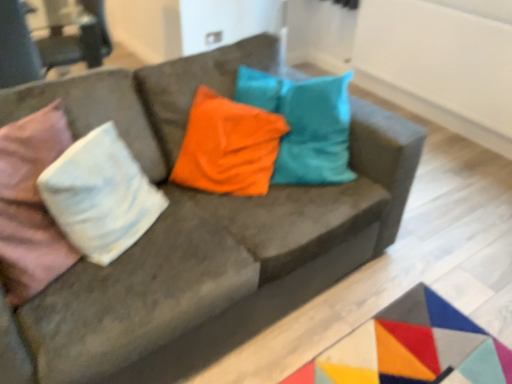
Measure the distance between velvet pink armchair at upper left and camera.

velvet pink armchair at upper left and camera are 8.76 feet apart from each other.

What do you see at coordinates (71, 35) in the screenshot? I see `velvet pink armchair at upper left` at bounding box center [71, 35].

Find the location of a particular element. The width and height of the screenshot is (512, 384). velvet pink armchair at upper left is located at coordinates (71, 35).

The width and height of the screenshot is (512, 384). I want to click on white cotton pillow at left, so click(100, 195).

The width and height of the screenshot is (512, 384). Describe the element at coordinates (100, 195) in the screenshot. I see `white cotton pillow at left` at that location.

You are a GUI agent. You are given a task and a screenshot of the screen. Output one action in this format:
    pyautogui.click(x=<x>, y=<y>)
    Task: Click on the velvet pink armchair at upper left
    The width and height of the screenshot is (512, 384).
    Given the screenshot: What is the action you would take?
    pyautogui.click(x=71, y=35)

Is white cotton pillow at left at the right side of velvet pink armchair at upper left?

Yes.

Is white cotton pillow at left further to camera compared to velvet pink armchair at upper left?

No, white cotton pillow at left is closer to the viewer.

Is point (93, 199) closer or farther from the camera than point (42, 10)?

Point (93, 199) is positioned closer to the camera compared to point (42, 10).

From the image's perspective, is white cotton pillow at left beneath velvet pink armchair at upper left?

Yes.

From a real-world perspective, is white cotton pillow at left below velvet pink armchair at upper left?

Actually, white cotton pillow at left is physically above velvet pink armchair at upper left in the real world.

Considering the sizes of objects white cotton pillow at left and velvet pink armchair at upper left in the image provided, who is thinner, white cotton pillow at left or velvet pink armchair at upper left?

Thinner between the two is white cotton pillow at left.

Between white cotton pillow at left and velvet pink armchair at upper left, which one has less height?

white cotton pillow at left is shorter.

Does white cotton pillow at left have a smaller size compared to velvet pink armchair at upper left?

Yes, white cotton pillow at left is smaller than velvet pink armchair at upper left.

Do you think white cotton pillow at left is within velvet pink armchair at upper left, or outside of it?

white cotton pillow at left is outside velvet pink armchair at upper left.

Is there a large distance between white cotton pillow at left and velvet pink armchair at upper left?

Yes.

Is white cotton pillow at left oriented towards velvet pink armchair at upper left?

No, white cotton pillow at left is not oriented towards velvet pink armchair at upper left.

Measure the distance between white cotton pillow at left and velvet pink armchair at upper left.

white cotton pillow at left is 6.16 feet from velvet pink armchair at upper left.

What are the coordinates of `pillow positioned vertically above the velvet pink armchair at upper left (from a real-world perspective)` in the screenshot? It's located at (100, 195).

Considering the positions of objects velvet pink armchair at upper left and white cotton pillow at left in the image provided, who is more to the right, velvet pink armchair at upper left or white cotton pillow at left?

Positioned to the right is white cotton pillow at left.

In the image, is velvet pink armchair at upper left positioned in front of or behind white cotton pillow at left?

In the image, velvet pink armchair at upper left appears behind white cotton pillow at left.

Considering the points (41, 7) and (104, 135), which point is behind, point (41, 7) or point (104, 135)?

Point (41, 7)

From the picture: From the image's perspective, is velvet pink armchair at upper left located above white cotton pillow at left?

Yes, from the image's perspective, velvet pink armchair at upper left is over white cotton pillow at left.

From a real-world perspective, is velvet pink armchair at upper left on top of white cotton pillow at left?

No, from a real-world perspective, velvet pink armchair at upper left is not on top of white cotton pillow at left.

Considering the sizes of objects velvet pink armchair at upper left and white cotton pillow at left in the image provided, who is thinner, velvet pink armchair at upper left or white cotton pillow at left?

white cotton pillow at left is thinner.

Considering the sizes of objects velvet pink armchair at upper left and white cotton pillow at left in the image provided, who is taller, velvet pink armchair at upper left or white cotton pillow at left?

velvet pink armchair at upper left.

Looking at the image, does velvet pink armchair at upper left seem bigger or smaller compared to white cotton pillow at left?

Considering their sizes, velvet pink armchair at upper left takes up more space than white cotton pillow at left.

Is velvet pink armchair at upper left positioned beyond the bounds of white cotton pillow at left?

Yes, velvet pink armchair at upper left is outside of white cotton pillow at left.

Is velvet pink armchair at upper left not near white cotton pillow at left?

velvet pink armchair at upper left is positioned a significant distance from white cotton pillow at left.

Is velvet pink armchair at upper left facing away from white cotton pillow at left?

velvet pink armchair at upper left is not turned away from white cotton pillow at left.

How different are the orientations of velvet pink armchair at upper left and white cotton pillow at left in degrees?

The facing directions of velvet pink armchair at upper left and white cotton pillow at left are 129 degrees apart.

This screenshot has width=512, height=384. I want to click on armchair that is under the white cotton pillow at left (from a real-world perspective), so click(x=71, y=35).

Where is `pillow above the velvet pink armchair at upper left (from a real-world perspective)`? The width and height of the screenshot is (512, 384). pillow above the velvet pink armchair at upper left (from a real-world perspective) is located at coordinates (100, 195).

In the image, there is a velvet pink armchair at upper left. Identify the location of pillow below it (from the image's perspective). This screenshot has width=512, height=384. (100, 195).